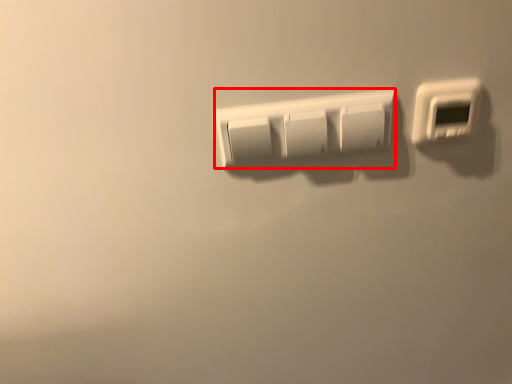
Question: From the image's perspective, what is the correct spatial relationship of light switch (annotated by the red box) in relation to light switch?

Choices:
 (A) above
 (B) below

Answer: (B)